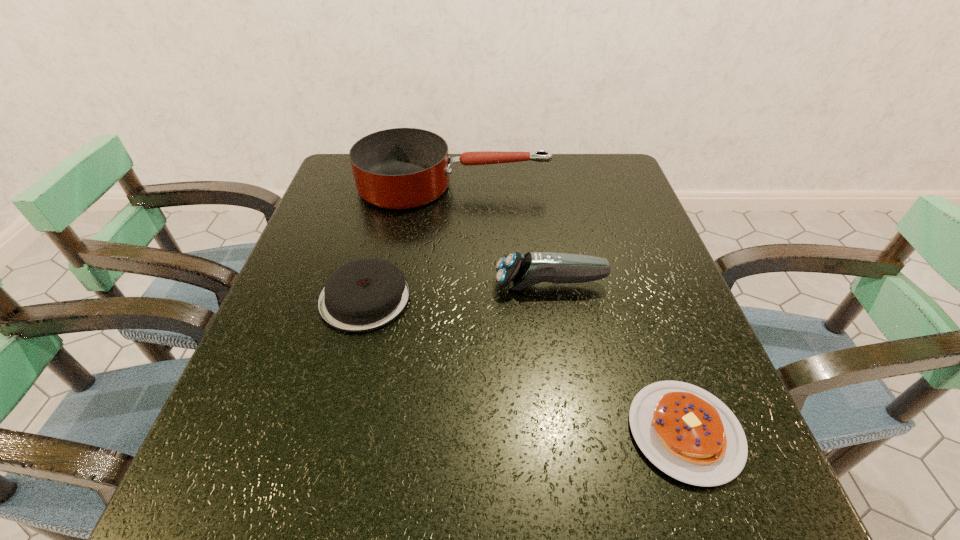
The image size is (960, 540). I want to click on free space located 0.110m on the head of the electric shaver, so click(444, 285).

Locate an element on the screen. The image size is (960, 540). vacant space located on the right of the second shortest object is located at coordinates (557, 298).

At what (x,y) coordinates should I click in order to perform the action: click on vacant area located on the back of the shortest object. Please return your answer as a coordinate pair (x, y). This screenshot has width=960, height=540. Looking at the image, I should click on pos(649,329).

Image resolution: width=960 pixels, height=540 pixels. What are the coordinates of `object that is at the far edge` in the screenshot? It's located at (401, 168).

Identify the location of object located in the near edge section of the desktop. (688, 433).

Where is `pan that is positioned at the left edge`? pan that is positioned at the left edge is located at coordinates (401, 168).

Image resolution: width=960 pixels, height=540 pixels. I want to click on pancake positioned at the left edge, so click(365, 294).

The width and height of the screenshot is (960, 540). In order to click on electric shaver located at the right edge in this screenshot , I will do `click(517, 271)`.

Locate an element on the screen. pancake present at the right edge is located at coordinates (688, 433).

Locate an element on the screen. This screenshot has height=540, width=960. object located in the far left corner section of the desktop is located at coordinates (401, 168).